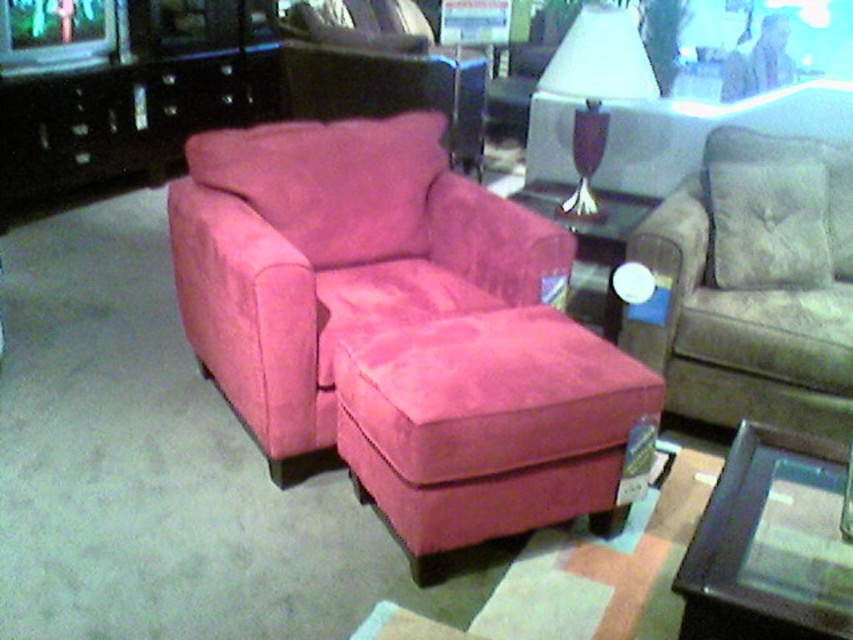
Question: Is suede-like beige pillow at upper right below matte white lamp at upper center?

Choices:
 (A) no
 (B) yes

Answer: (B)

Question: Which of the following is the farthest from the observer?

Choices:
 (A) suede beige armchair at right
 (B) suede pink ottoman at center
 (C) suede-like beige pillow at upper right

Answer: (C)

Question: Is suede beige armchair at right positioned before suede-like beige pillow at upper right?

Choices:
 (A) yes
 (B) no

Answer: (A)

Question: Which point is farther to the camera?

Choices:
 (A) suede-like beige pillow at upper right
 (B) matte black entertainment center at left
 (C) matte white lamp at upper center

Answer: (B)

Question: Among these points, which one is farthest from the camera?

Choices:
 (A) (801, 168)
 (B) (775, 173)
 (C) (361, 456)
 (D) (567, 204)

Answer: (D)

Question: Is suede pink ottoman at center thinner than matte black entertainment center at left?

Choices:
 (A) yes
 (B) no

Answer: (A)